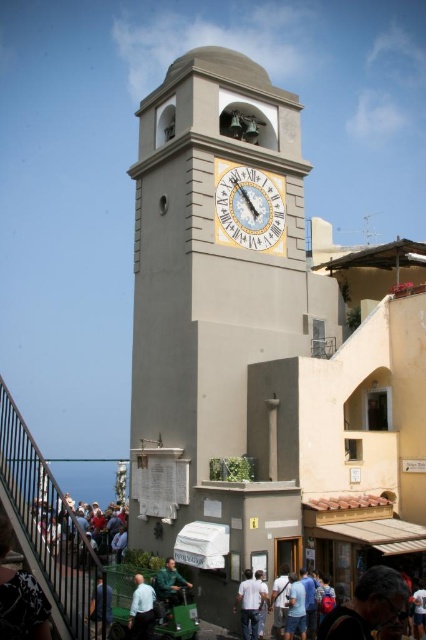
Question: Which of the following is the closest to the observer?

Choices:
 (A) black metal railing at lower left
 (B) red shirt at lower left
 (C) smooth concrete clock tower at center
 (D) green fabric jacket at center

Answer: (A)

Question: Can you confirm if black metal railing at lower left is smaller than light blue shirt at lower center?

Choices:
 (A) no
 (B) yes

Answer: (A)

Question: Estimate the real-world distances between objects in this image. Which object is closer to the dark brown leather jacket at lower right?

Choices:
 (A) smooth concrete clock tower at center
 (B) green fabric jacket at center

Answer: (B)

Question: Which point is closer to the camera?

Choices:
 (A) (0, 497)
 (B) (265, 198)
 (C) (75, 516)

Answer: (A)

Question: Can you confirm if wooden clock face at center is positioned to the right of white cotton shirt at center?

Choices:
 (A) yes
 (B) no

Answer: (B)

Question: Is smooth concrete clock tower at center bigger than green fabric jacket at center?

Choices:
 (A) no
 (B) yes

Answer: (B)